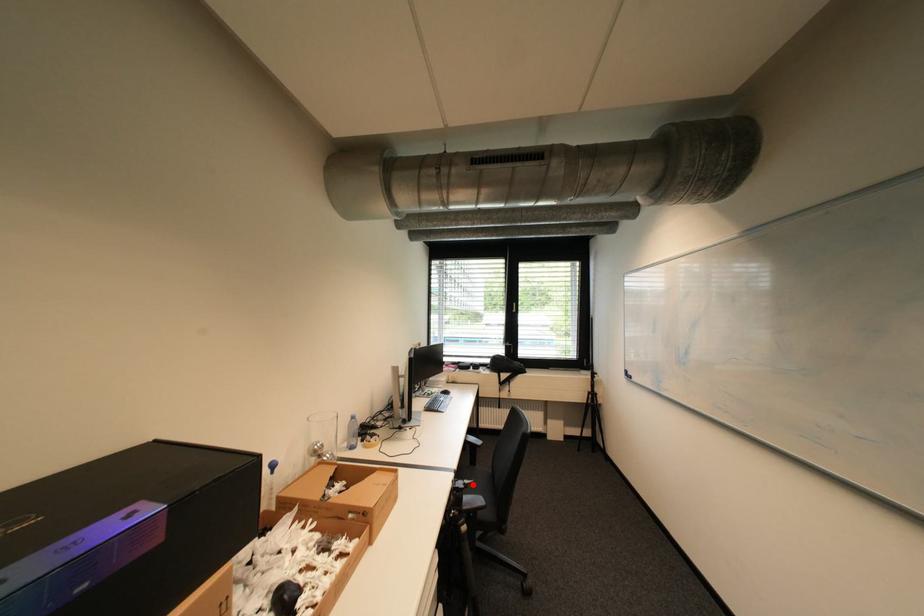
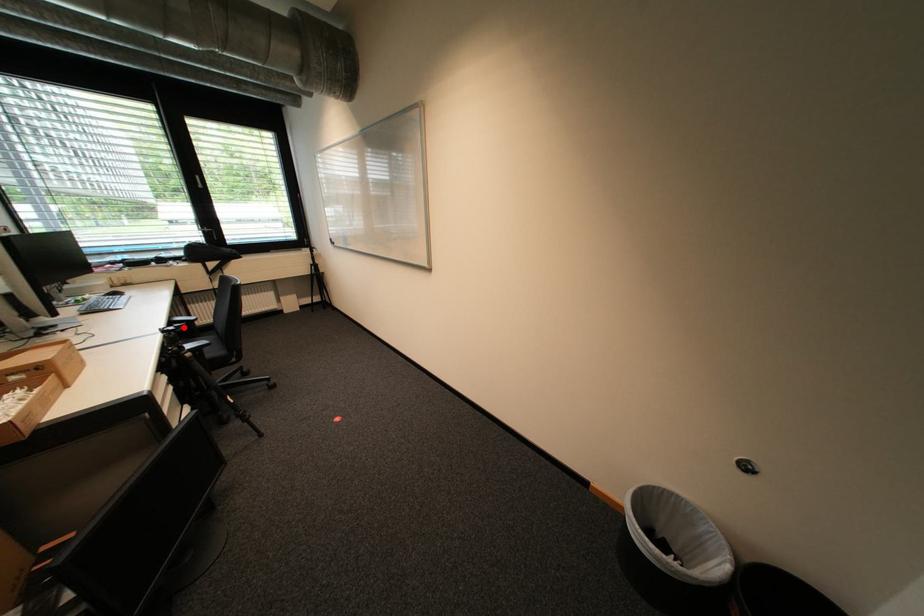
I am providing you with two images of the same scene from different viewpoints. A red point is marked on the first image and another point is marked on the second image. Is the marked point in image1 the same physical position as the marked point in image2?

Yes